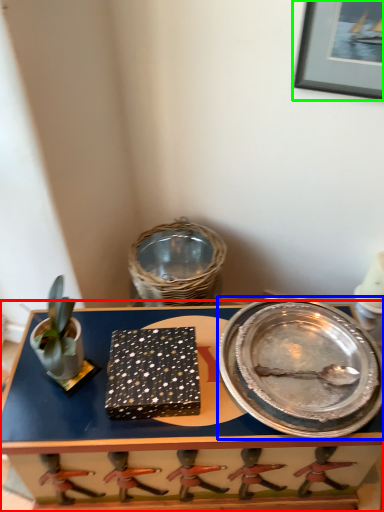
Question: Which object is positioned farthest from table (highlighted by a red box)? Select from platter (highlighted by a blue box) and picture frame (highlighted by a green box).

Choices:
 (A) platter
 (B) picture frame

Answer: (B)